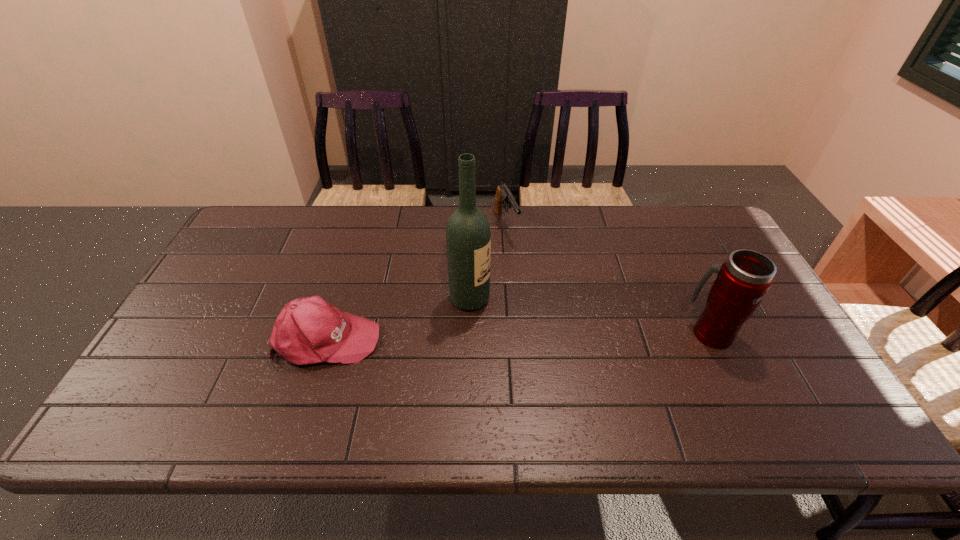
Where is `vacant space on the desktop that is between the leftmost object and the second tallest object and is positioned on the labeled side of the second object from left to right`? The width and height of the screenshot is (960, 540). vacant space on the desktop that is between the leftmost object and the second tallest object and is positioned on the labeled side of the second object from left to right is located at coordinates 559,335.

Where is `free spot on the desktop that is between the leftmost object and the thermos bottle and is positioned along the barrel of the farthest object`? free spot on the desktop that is between the leftmost object and the thermos bottle and is positioned along the barrel of the farthest object is located at coordinates (565, 335).